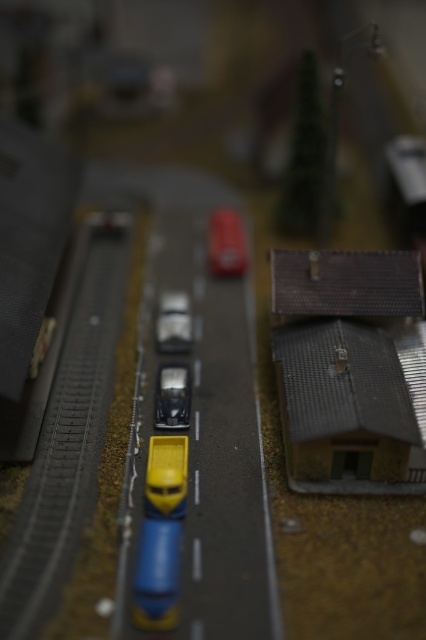
Question: Observing the image, what is the correct spatial positioning of yellow matte truck at center in reference to shiny silver car at center?

Choices:
 (A) right
 (B) left

Answer: (A)

Question: Which object appears farthest from the camera in this image?

Choices:
 (A) yellow matte truck at center
 (B) brown textured roof at right
 (C) matte silver car at center
 (D) smooth gray train track at center

Answer: (C)

Question: Can you confirm if brown textured roof at right is wider than matte silver car at center?

Choices:
 (A) yes
 (B) no

Answer: (A)

Question: Which object appears farthest from the camera in this image?

Choices:
 (A) brown textured roof at right
 (B) yellow matte truck at center
 (C) matte silver car at center

Answer: (C)

Question: Does smooth gray train track at center appear under yellow matte truck at center?

Choices:
 (A) no
 (B) yes

Answer: (A)

Question: Which point is closer to the camera?

Choices:
 (A) brown textured roof at right
 (B) matte silver car at center
 (C) smooth gray train track at center
 (D) yellow matte truck at center

Answer: (C)